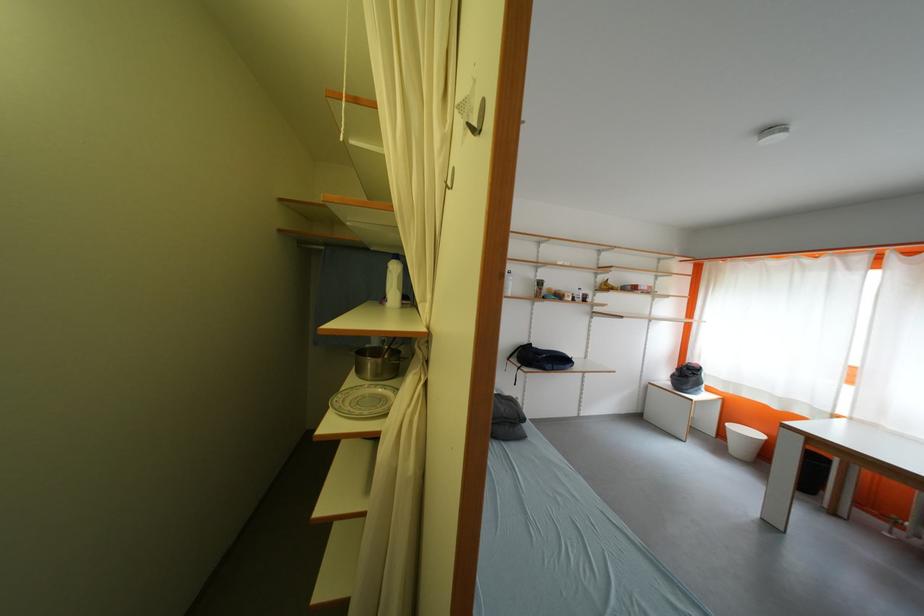
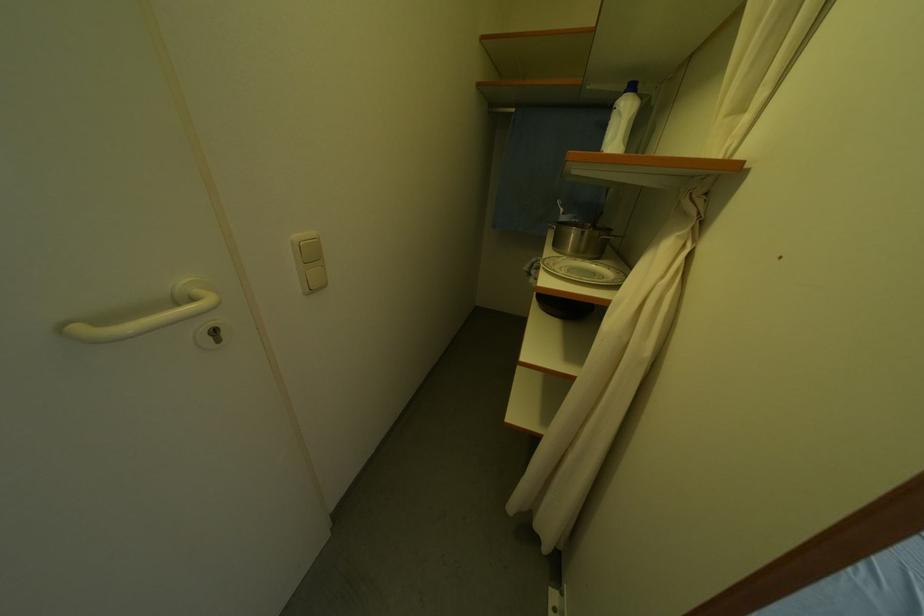
Locate, in the second image, the point that corresponds to point (345, 403) in the first image.

(554, 265)